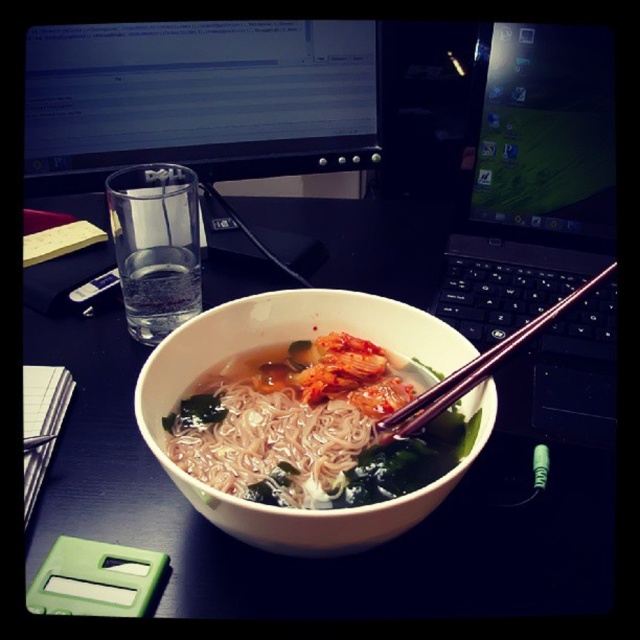
Looking at this image, you are organizing a desk and need to place a new monitor. The current desk has a matte black monitor at upper center located at point (x=198, y=99). Where should you place the new monitor to avoid overlapping with the existing one?

The new monitor should be placed away from point (x=198, y=99) to avoid overlapping with the existing matte black monitor at upper center.

You are organizing your desk and need to move the black plastic laptop at center and the white matte noodles at center. Which object should you move first if you want to place them both to the left side of your desk?

You should move the black plastic laptop at center first because it is currently to the right of the white matte noodles at center, so moving it first would allow you to position both objects to the left side without obstructing the noodles.

You are organizing your desk and need to place a new lamp. The lamp requires a space that is not occupied by the matte black monitor at upper center. Based on the coordinates provided, where should you place the lamp to avoid overlapping with the monitor?

The matte black monitor at upper center is located at point (198,99). To avoid overlapping, place the lamp at a different coordinate, such as (320,256).